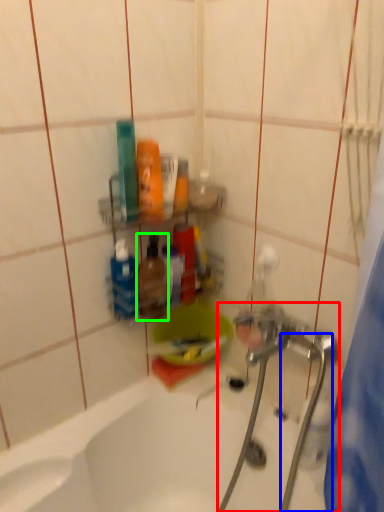
Question: Which is farther away from plumbing fixture (highlighted by a red box)? water pipe (highlighted by a blue box) or mouthwash (highlighted by a green box)?

Choices:
 (A) water pipe
 (B) mouthwash

Answer: (B)